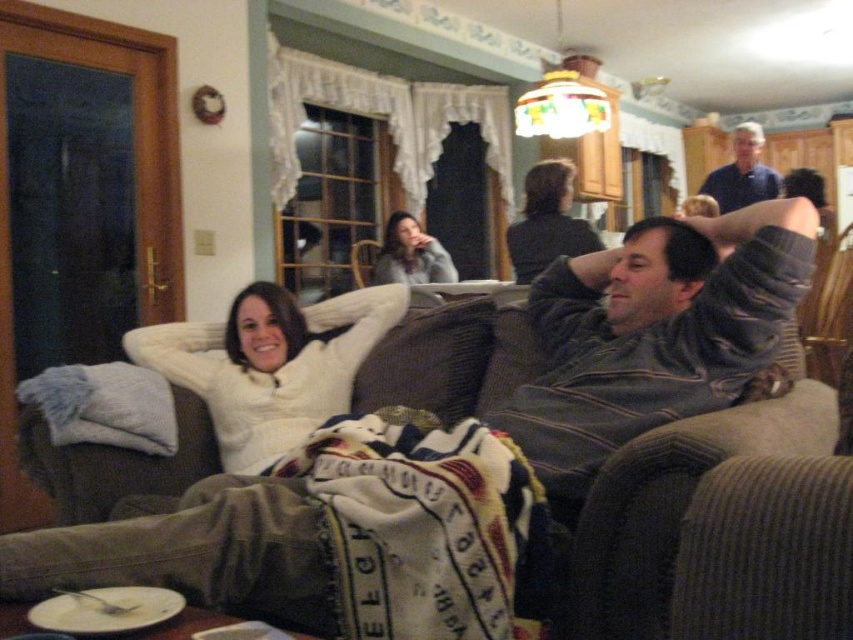
Question: Is gray striped sweater at center closer to the viewer compared to white fuzzy sweater at center?

Choices:
 (A) yes
 (B) no

Answer: (A)

Question: Can you confirm if matte gray sweater at center is smaller than blue cotton shirt at upper right?

Choices:
 (A) no
 (B) yes

Answer: (B)

Question: Is the position of dark gray corduroy couch at center less distant than that of white fuzzy sweater at center?

Choices:
 (A) yes
 (B) no

Answer: (A)

Question: Among these objects, which one is farthest from the camera?

Choices:
 (A) gray striped sweater at center
 (B) brown fabric pillow at center
 (C) matte gray sweater at center

Answer: (C)

Question: Which of the following is the farthest from the observer?

Choices:
 (A) matte gray sweater at center
 (B) dark gray corduroy couch at center
 (C) dark brown hair at upper center

Answer: (A)

Question: Which point appears closest to the camera in this image?

Choices:
 (A) (367, 323)
 (B) (517, 236)

Answer: (A)